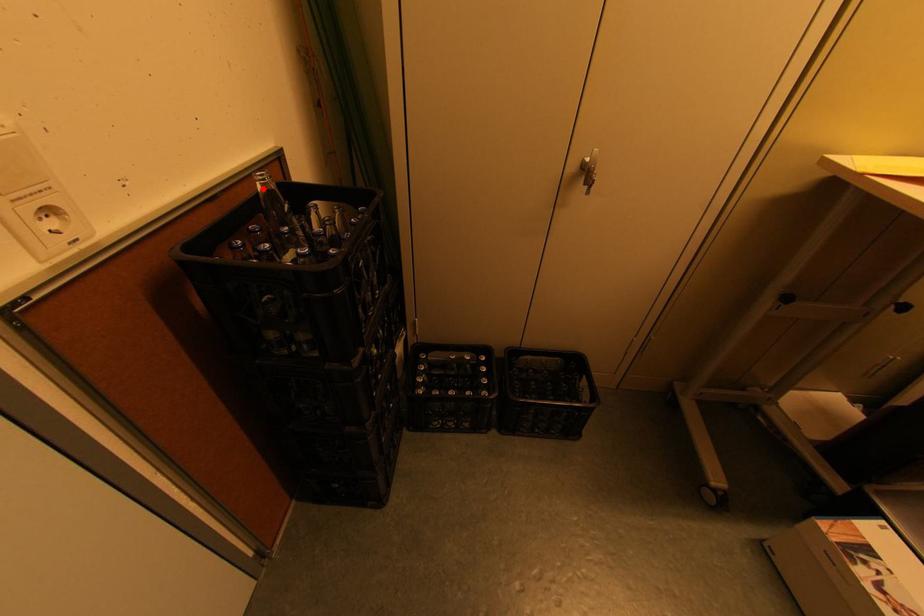
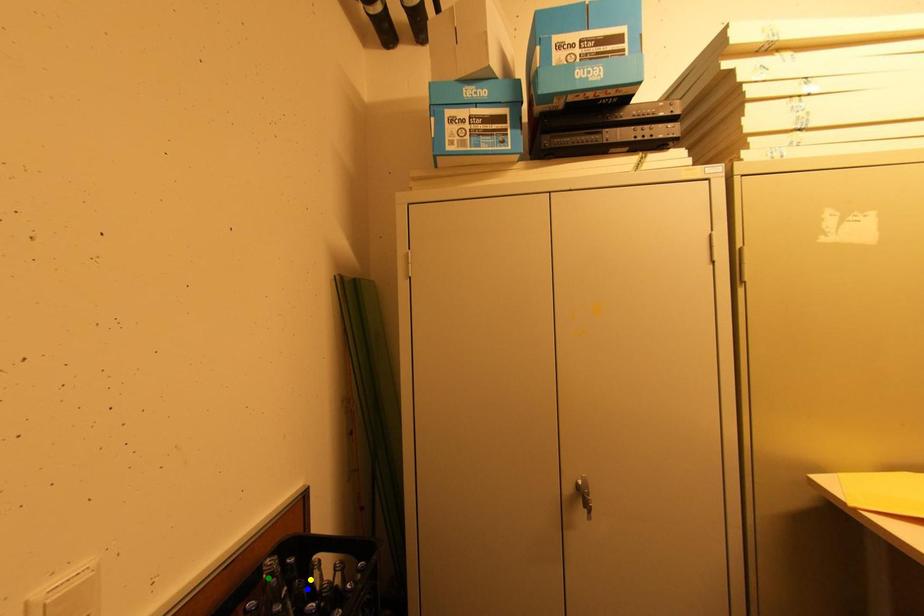
Question: I am providing you with two images of the same scene from different viewpoints. A red point is marked on the first image. You are given multiple points on the second image. In image 2, which mark is for the same physical point as the one in image 1?

Choices:
 (A) blue point
 (B) green point
 (C) yellow point

Answer: (B)